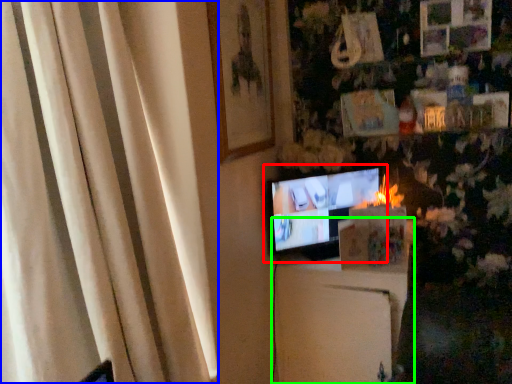
Question: Based on their relative distances, which object is nearer to television (highlighted by a red box)? Choose from curtain (highlighted by a blue box) and furniture (highlighted by a green box).

Choices:
 (A) curtain
 (B) furniture

Answer: (B)